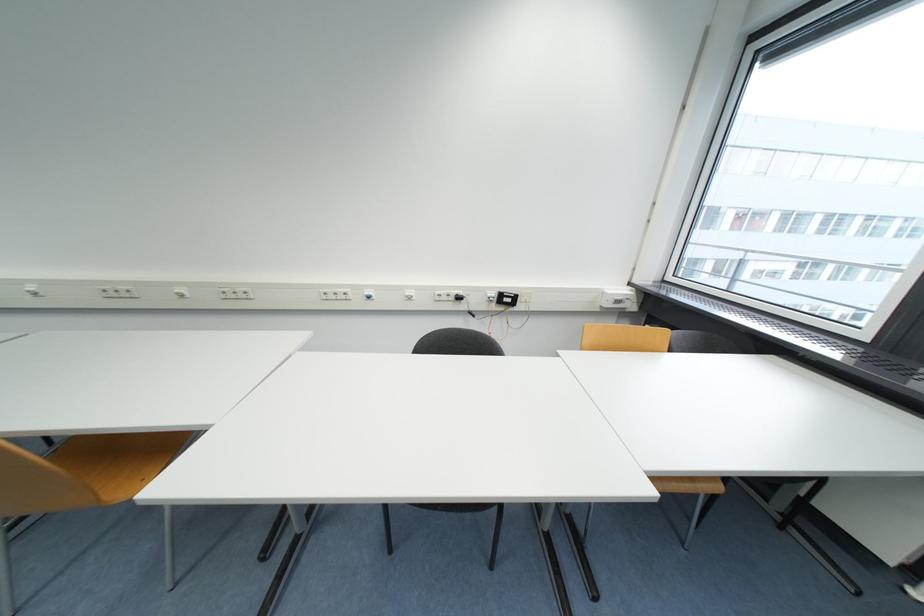
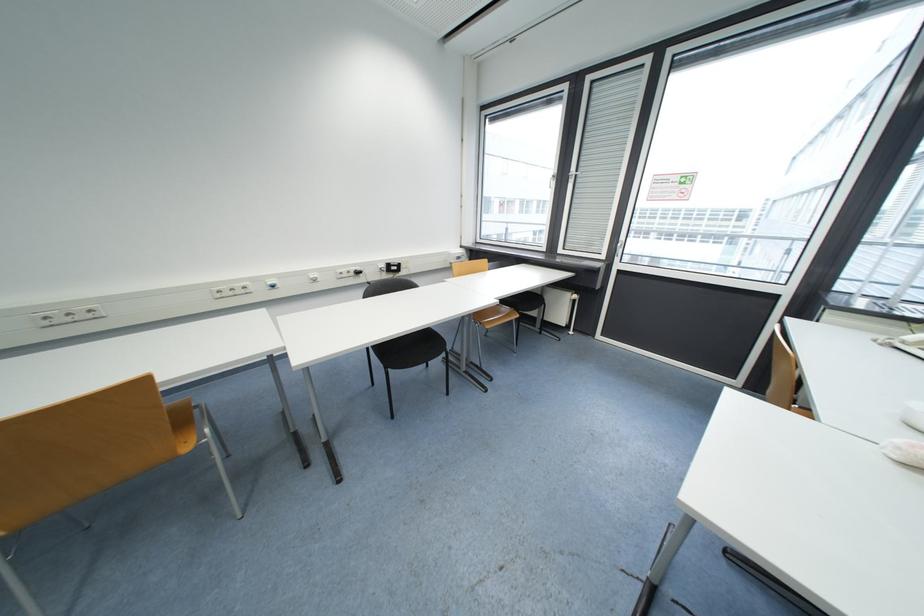
Find the pixel in the second image that matches [371,294] in the first image.

(274, 285)